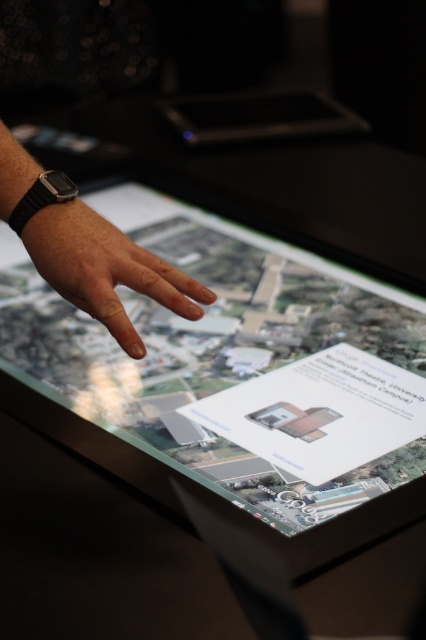
Who is lower down, transparent glass map at center or black glossy tablet at upper center?

transparent glass map at center is below.

Which is behind, point (175, 397) or point (253, 113)?

The point (253, 113) is more distant.

Where is `transparent glass map at center`? transparent glass map at center is located at coordinates (236, 364).

Does transparent glass map at center have a lesser height compared to smooth skin hand at center?

In fact, transparent glass map at center may be taller than smooth skin hand at center.

Is transparent glass map at center positioned at the back of smooth skin hand at center?

No, it is in front of smooth skin hand at center.

Does point (386, 337) come closer to viewer compared to point (109, 321)?

No, (386, 337) is further to viewer.

Where is `transparent glass map at center`? This screenshot has height=640, width=426. transparent glass map at center is located at coordinates (236, 364).

Which is behind, point (31, 236) or point (219, 122)?

Positioned behind is point (219, 122).

Between smooth skin hand at center and black glossy tablet at upper center, which one has more height?

black glossy tablet at upper center

Find the location of a particular element. The image size is (426, 640). smooth skin hand at center is located at coordinates (104, 268).